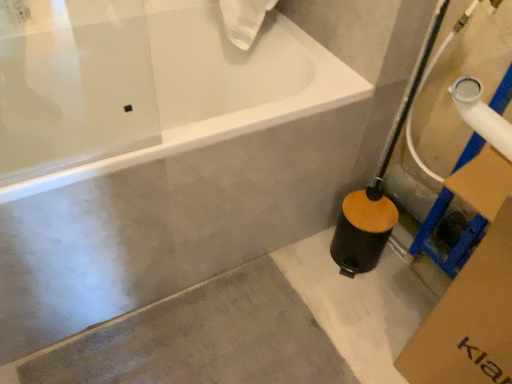
Find the location of a particular element. This screenshot has height=384, width=512. white glossy bathtub at upper center is located at coordinates (230, 116).

This screenshot has width=512, height=384. What do you see at coordinates (230, 116) in the screenshot?
I see `white glossy bathtub at upper center` at bounding box center [230, 116].

The width and height of the screenshot is (512, 384). I want to click on gray concrete at lower left, so [252, 328].

What do you see at coordinates (252, 328) in the screenshot? I see `gray concrete at lower left` at bounding box center [252, 328].

Image resolution: width=512 pixels, height=384 pixels. What are the coordinates of `white glossy bathtub at upper center` in the screenshot? It's located at (230, 116).

Which object is positioned more to the left, white glossy bathtub at upper center or gray concrete at lower left?

Positioned to the left is white glossy bathtub at upper center.

In the image, is white glossy bathtub at upper center positioned in front of or behind gray concrete at lower left?

white glossy bathtub at upper center is positioned closer to the viewer than gray concrete at lower left.

Does point (315, 112) lie in front of point (108, 364)?

Yes, point (315, 112) is in front of point (108, 364).

From the image's perspective, is white glossy bathtub at upper center under gray concrete at lower left?

No.

From the picture: From a real-world perspective, is white glossy bathtub at upper center located higher than gray concrete at lower left?

Indeed, from a real-world perspective, white glossy bathtub at upper center stands above gray concrete at lower left.

In terms of width, does white glossy bathtub at upper center look wider or thinner when compared to gray concrete at lower left?

In the image, white glossy bathtub at upper center appears to be wider than gray concrete at lower left.

Considering the relative sizes of white glossy bathtub at upper center and gray concrete at lower left in the image provided, is white glossy bathtub at upper center taller than gray concrete at lower left?

Yes, white glossy bathtub at upper center is taller than gray concrete at lower left.

Is white glossy bathtub at upper center bigger or smaller than gray concrete at lower left?

white glossy bathtub at upper center is bigger than gray concrete at lower left.

Is white glossy bathtub at upper center completely or partially outside of gray concrete at lower left?

white glossy bathtub at upper center is positioned outside gray concrete at lower left.

Is white glossy bathtub at upper center positioned far away from gray concrete at lower left?

white glossy bathtub at upper center is near gray concrete at lower left, not far away.

Is white glossy bathtub at upper center turned away from gray concrete at lower left?

No.

This screenshot has width=512, height=384. What are the coordinates of `concrete below the white glossy bathtub at upper center (from a real-world perspective)` in the screenshot? It's located at (252, 328).

In the image, is gray concrete at lower left on the left side or the right side of white glossy bathtub at upper center?

Clearly, gray concrete at lower left is on the right of white glossy bathtub at upper center in the image.

From the picture: Is gray concrete at lower left closer to camera compared to white glossy bathtub at upper center?

No, gray concrete at lower left is further to the viewer.

Considering the positions of point (362, 340) and point (305, 53), is point (362, 340) closer or farther from the camera than point (305, 53)?

Clearly, point (362, 340) is closer to the camera than point (305, 53).

From the image's perspective, is gray concrete at lower left over white glossy bathtub at upper center?

No, from the image's perspective, gray concrete at lower left is not on top of white glossy bathtub at upper center.

From a real-world perspective, is gray concrete at lower left physically located above or below white glossy bathtub at upper center?

gray concrete at lower left is situated lower than white glossy bathtub at upper center in the real world.

Considering the relative sizes of gray concrete at lower left and white glossy bathtub at upper center in the image provided, is gray concrete at lower left wider than white glossy bathtub at upper center?

Incorrect, the width of gray concrete at lower left does not surpass that of white glossy bathtub at upper center.

Is gray concrete at lower left taller than white glossy bathtub at upper center?

No.

Looking at the image, does gray concrete at lower left seem bigger or smaller compared to white glossy bathtub at upper center?

Clearly, gray concrete at lower left is smaller in size than white glossy bathtub at upper center.

Would you say gray concrete at lower left is outside white glossy bathtub at upper center?

Yes, gray concrete at lower left is located beyond the bounds of white glossy bathtub at upper center.

Are gray concrete at lower left and white glossy bathtub at upper center beside each other?

gray concrete at lower left is not next to white glossy bathtub at upper center, and they're not touching.

Is gray concrete at lower left oriented away from white glossy bathtub at upper center?

Yes, white glossy bathtub at upper center is at the back of gray concrete at lower left.

What's the angular difference between gray concrete at lower left and white glossy bathtub at upper center's facing directions?

The angular difference between gray concrete at lower left and white glossy bathtub at upper center is 0.275 degrees.

The image size is (512, 384). What are the coordinates of `bathtub to the left of gray concrete at lower left` in the screenshot? It's located at (230, 116).

Identify the location of concrete on the right side of white glossy bathtub at upper center. (252, 328).

You are a GUI agent. You are given a task and a screenshot of the screen. Output one action in this format:
    pyautogui.click(x=<x>, y=<y>)
    Task: Click on the bathtub on the left of the gray concrete at lower left
    This screenshot has height=384, width=512.
    Given the screenshot: What is the action you would take?
    click(x=230, y=116)